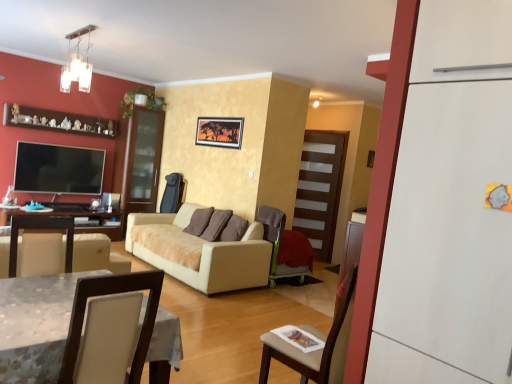
Question: Does brown wooden shelf at upper left appear on the left side of velvet brown armchair at center, marked as the 2th chair in a front-to-back arrangement?

Choices:
 (A) no
 (B) yes

Answer: (B)

Question: Is brown wooden shelf at upper left wider than velvet brown armchair at center, marked as the 2th chair in a front-to-back arrangement?

Choices:
 (A) yes
 (B) no

Answer: (B)

Question: Is brown wooden shelf at upper left further to the viewer compared to velvet brown armchair at center, marked as the 2th chair in a front-to-back arrangement?

Choices:
 (A) no
 (B) yes

Answer: (B)

Question: From a real-world perspective, is brown wooden shelf at upper left positioned under velvet brown armchair at center, positioned as the 1th chair in right-to-left order, based on gravity?

Choices:
 (A) yes
 (B) no

Answer: (B)

Question: Considering the relative positions of brown wooden shelf at upper left and velvet brown armchair at center, arranged as the 2th chair when viewed from the left, in the image provided, is brown wooden shelf at upper left to the right of velvet brown armchair at center, arranged as the 2th chair when viewed from the left, from the viewer's perspective?

Choices:
 (A) no
 (B) yes

Answer: (A)

Question: Does brown wooden shelf at upper left have a smaller size compared to velvet brown armchair at center, the first chair positioned from the back?

Choices:
 (A) yes
 (B) no

Answer: (A)

Question: From a real-world perspective, is white leather chair at lower left, which ranks as the 1th chair in front-to-back order, on top of brown wooden shelf at upper left?

Choices:
 (A) no
 (B) yes

Answer: (A)

Question: Is white leather chair at lower left, arranged as the second chair when viewed from the back, positioned with its back to brown wooden shelf at upper left?

Choices:
 (A) yes
 (B) no

Answer: (B)

Question: Is white leather chair at lower left, which ranks as the 1th chair in front-to-back order, shorter than brown wooden shelf at upper left?

Choices:
 (A) no
 (B) yes

Answer: (A)

Question: Considering the relative positions of white leather chair at lower left, arranged as the second chair when viewed from the back, and brown wooden shelf at upper left in the image provided, is white leather chair at lower left, arranged as the second chair when viewed from the back, to the left of brown wooden shelf at upper left from the viewer's perspective?

Choices:
 (A) no
 (B) yes

Answer: (A)

Question: From a real-world perspective, does white leather chair at lower left, placed as the second chair when sorted from right to left, sit lower than brown wooden shelf at upper left?

Choices:
 (A) no
 (B) yes

Answer: (B)

Question: Does white leather chair at lower left, arranged as the second chair when viewed from the back, come in front of brown wooden shelf at upper left?

Choices:
 (A) yes
 (B) no

Answer: (A)

Question: Considering the relative positions of velvet brown armchair at center, marked as the 2th chair in a front-to-back arrangement, and flat screen tv at left in the image provided, is velvet brown armchair at center, marked as the 2th chair in a front-to-back arrangement, to the left of flat screen tv at left from the viewer's perspective?

Choices:
 (A) no
 (B) yes

Answer: (A)